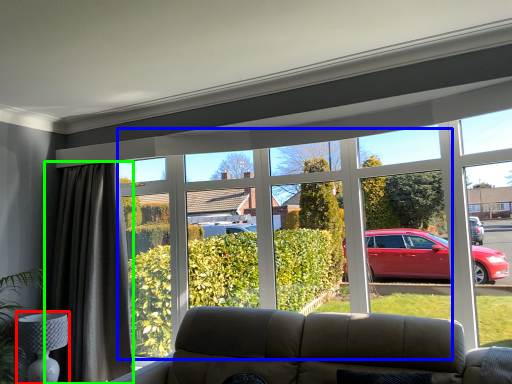
Question: Which is farther away from lamp (highlighted by a red box)? bay window (highlighted by a blue box) or curtain (highlighted by a green box)?

Choices:
 (A) bay window
 (B) curtain

Answer: (A)